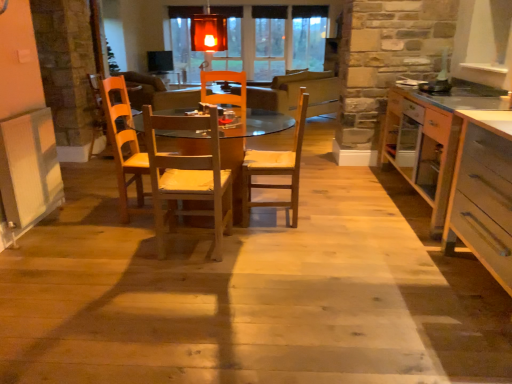
Question: Should I look upward or downward to see wooden chair at center, the second chair viewed from the right?

Choices:
 (A) down
 (B) up

Answer: (B)

Question: Is light brown wooden chair at center, placed as the first chair when sorted from right to left, wider than light wood drawer at right?

Choices:
 (A) no
 (B) yes

Answer: (A)

Question: Is light brown wooden chair at center, placed as the first chair when sorted from right to left, not close to light wood drawer at right?

Choices:
 (A) no
 (B) yes

Answer: (B)

Question: Is light wood drawer at right located within light brown wooden chair at center, marked as the second chair in a left-to-right arrangement?

Choices:
 (A) yes
 (B) no

Answer: (B)

Question: From a real-world perspective, is light brown wooden chair at center, marked as the second chair in a left-to-right arrangement, on top of light wood drawer at right?

Choices:
 (A) yes
 (B) no

Answer: (A)

Question: Is light brown wooden chair at center, marked as the second chair in a left-to-right arrangement, aimed at light wood drawer at right?

Choices:
 (A) no
 (B) yes

Answer: (A)

Question: Does light brown wooden chair at center, marked as the second chair in a left-to-right arrangement, have a greater height compared to light wood drawer at right?

Choices:
 (A) yes
 (B) no

Answer: (A)

Question: Is white laminate countertop at right smaller than light wood drawer at right?

Choices:
 (A) no
 (B) yes

Answer: (A)

Question: Is white laminate countertop at right not near light wood drawer at right?

Choices:
 (A) yes
 (B) no

Answer: (B)

Question: Can you confirm if white laminate countertop at right is positioned to the left of light wood drawer at right?

Choices:
 (A) no
 (B) yes

Answer: (A)

Question: From the image's perspective, does white laminate countertop at right appear higher than light wood drawer at right?

Choices:
 (A) no
 (B) yes

Answer: (B)

Question: Considering the relative sizes of white laminate countertop at right and light wood drawer at right in the image provided, is white laminate countertop at right shorter than light wood drawer at right?

Choices:
 (A) no
 (B) yes

Answer: (A)

Question: Considering the relative sizes of white laminate countertop at right and light wood drawer at right in the image provided, is white laminate countertop at right wider than light wood drawer at right?

Choices:
 (A) yes
 (B) no

Answer: (A)

Question: Considering the relative sizes of light brown wooden chair at center, marked as the second chair in a left-to-right arrangement, and wooden chair at center, the second chair viewed from the right, in the image provided, is light brown wooden chair at center, marked as the second chair in a left-to-right arrangement, thinner than wooden chair at center, the second chair viewed from the right,?

Choices:
 (A) no
 (B) yes

Answer: (A)